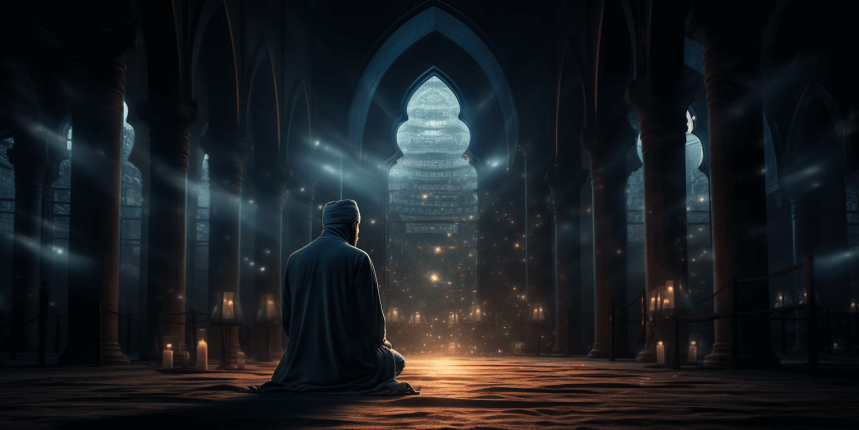
Locate an element on the screen. Image resolution: width=859 pixels, height=430 pixels. pillars is located at coordinates (735, 236), (667, 228), (606, 234), (107, 243), (171, 238), (223, 248), (271, 251), (297, 228), (569, 270), (539, 259).